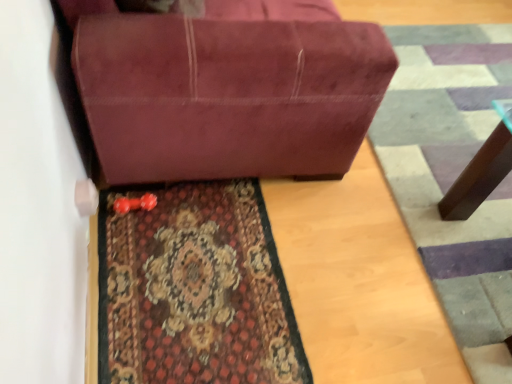
Identify the location of vacant area on top of carpeted rug at lower center (from a real-world perspective). The image size is (512, 384). (197, 271).